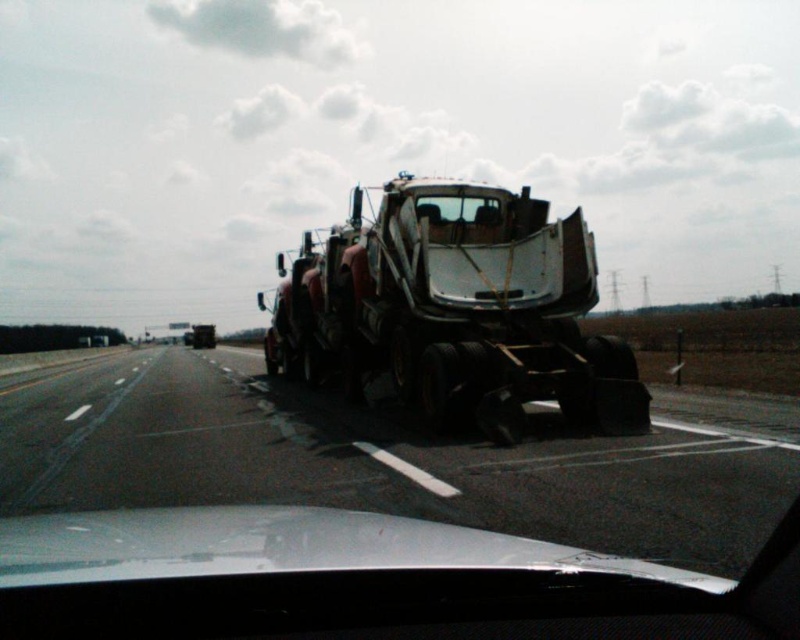
Question: Which point appears closest to the camera in this image?

Choices:
 (A) (484, 234)
 (B) (404, 228)
 (C) (214, 452)

Answer: (C)

Question: Which of these objects is positioned closest to the black asphalt highway at center?

Choices:
 (A) clear glass windshield at center
 (B) rusty metal tow truck at center

Answer: (B)

Question: Among these points, which one is nearest to the camera?

Choices:
 (A) (92, 477)
 (B) (452, 202)
 (C) (502, 317)

Answer: (A)

Question: Does rusty metal tow truck at center have a greater width compared to clear glass windshield at center?

Choices:
 (A) no
 (B) yes

Answer: (B)

Question: Can you confirm if black asphalt highway at center is wider than clear glass windshield at center?

Choices:
 (A) no
 (B) yes

Answer: (B)

Question: Is black asphalt highway at center closer to camera compared to rusty metal tow truck at center?

Choices:
 (A) no
 (B) yes

Answer: (B)